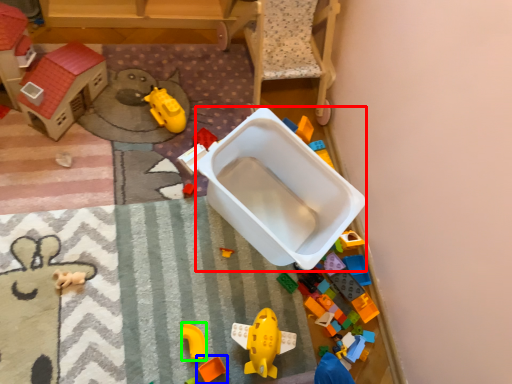
Question: Considering the real-world distances, which object is closest to storage box (highlighted by a red box)? toy (highlighted by a blue box) or toy (highlighted by a green box).

Choices:
 (A) toy
 (B) toy

Answer: (B)